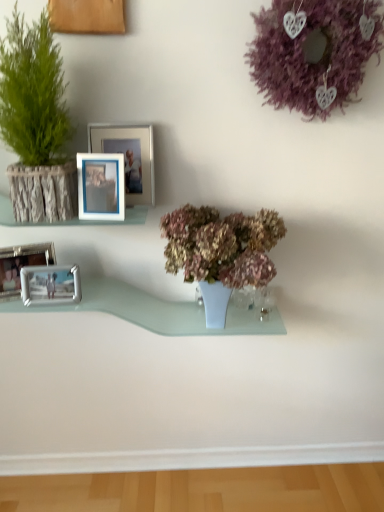
Question: From a real-world perspective, does wooden frame at left stand above green textured plant at left, the first houseplant when ordered from left to right?

Choices:
 (A) no
 (B) yes

Answer: (A)

Question: Is wooden frame at left positioned beyond the bounds of green textured plant at left, the first houseplant when ordered from top to bottom?

Choices:
 (A) no
 (B) yes

Answer: (A)

Question: Considering the relative sizes of wooden frame at left and green textured plant at left, which is counted as the 2th houseplant, starting from the right, in the image provided, is wooden frame at left wider than green textured plant at left, which is counted as the 2th houseplant, starting from the right,?

Choices:
 (A) yes
 (B) no

Answer: (B)

Question: Considering the relative sizes of wooden frame at left and green textured plant at left, which is counted as the 2th houseplant, starting from the right, in the image provided, is wooden frame at left smaller than green textured plant at left, which is counted as the 2th houseplant, starting from the right,?

Choices:
 (A) no
 (B) yes

Answer: (B)

Question: Is wooden frame at left next to green textured plant at left, the first houseplant when ordered from top to bottom, and touching it?

Choices:
 (A) no
 (B) yes

Answer: (A)

Question: From the image's perspective, relative to purple matte wreath at upper right, is metallic silver picture frame at left, the 3th picture frame viewed from the right, above or below?

Choices:
 (A) below
 (B) above

Answer: (A)

Question: Considering their positions, is metallic silver picture frame at left, the second picture frame when ordered from left to right, located in front of or behind purple matte wreath at upper right?

Choices:
 (A) front
 (B) behind

Answer: (B)

Question: Is point (51, 294) positioned closer to the camera than point (344, 47)?

Choices:
 (A) farther
 (B) closer

Answer: (A)

Question: Do you think metallic silver picture frame at left, the 3th picture frame viewed from the right, is within purple matte wreath at upper right, or outside of it?

Choices:
 (A) outside
 (B) inside

Answer: (A)

Question: From the image's perspective, is metallic silver picture frame at lower left, which is the fourth picture frame from right to left, positioned above or below purple matte wreath at upper right?

Choices:
 (A) above
 (B) below

Answer: (B)

Question: Based on their positions, is metallic silver picture frame at lower left, which is counted as the first picture frame, starting from the left, located to the left or right of purple matte wreath at upper right?

Choices:
 (A) left
 (B) right

Answer: (A)

Question: From their relative heights in the image, would you say metallic silver picture frame at lower left, which is counted as the first picture frame, starting from the left, is taller or shorter than purple matte wreath at upper right?

Choices:
 (A) short
 (B) tall

Answer: (A)

Question: Choose the correct answer: Is metallic silver picture frame at lower left, which is the fourth picture frame from right to left, inside purple matte wreath at upper right or outside it?

Choices:
 (A) outside
 (B) inside

Answer: (A)

Question: Is wooden frame at left in front of or behind blue plastic picture frame at upper center, acting as the 4th picture frame starting from the left, in the image?

Choices:
 (A) front
 (B) behind

Answer: (A)

Question: From their relative heights in the image, would you say wooden frame at left is taller or shorter than blue plastic picture frame at upper center, acting as the 4th picture frame starting from the left?

Choices:
 (A) tall
 (B) short

Answer: (B)